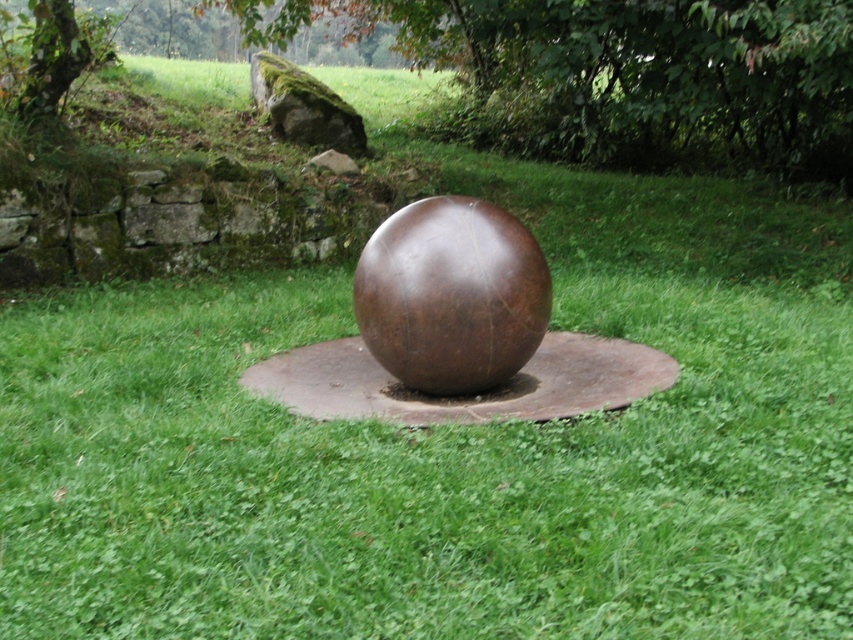
Question: Is brown leather sphere at center wider than mossy rock at upper left?

Choices:
 (A) no
 (B) yes

Answer: (A)

Question: From the image, what is the correct spatial relationship of brown leather sphere at center in relation to mossy rock at upper left?

Choices:
 (A) right
 (B) left

Answer: (A)

Question: Is brown leather sphere at center closer to the viewer compared to mossy rock at upper left?

Choices:
 (A) yes
 (B) no

Answer: (A)